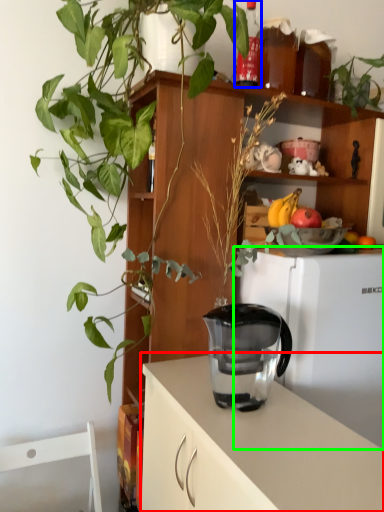
Question: Which object is positioned farthest from cabinetry (highlighted by a red box)? Select from bottle (highlighted by a blue box) and refrigerator (highlighted by a green box).

Choices:
 (A) bottle
 (B) refrigerator

Answer: (A)